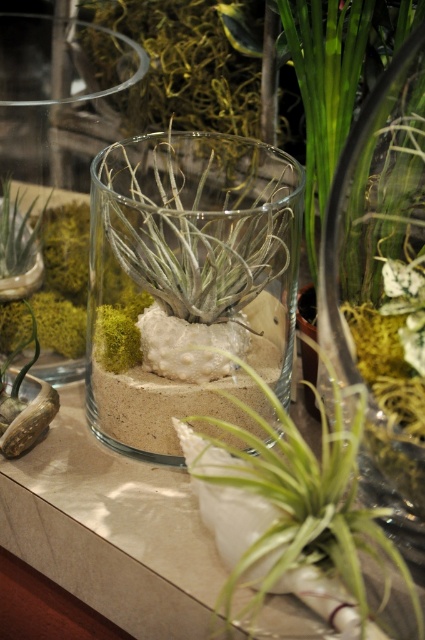
Where is the green leafy plant at center located in the image?

The green leafy plant at center is located at point (x=291, y=515).

In the scene shown: You are an interior designer arranging a living room. You have a clear glass vase at center and a green leafy plant at center. Which object is placed on top of the other?

The clear glass vase at center is positioned over the green leafy plant at center, so the glass vase is on top of the plant.

You are designing a miniature garden and have both the green leafy plant at center and the green moss at left available. Which one would you choose if you want a plant that takes up more space?

The green leafy plant at center has a larger width than the green moss at left, so it would be the better choice for a plant that takes up more space.